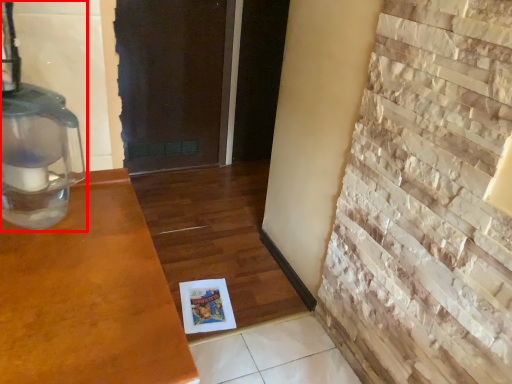
Question: From the image's perspective, what is the correct spatial relationship of oil lamp (annotated by the red box) in relation to brickwork?

Choices:
 (A) above
 (B) below

Answer: (A)